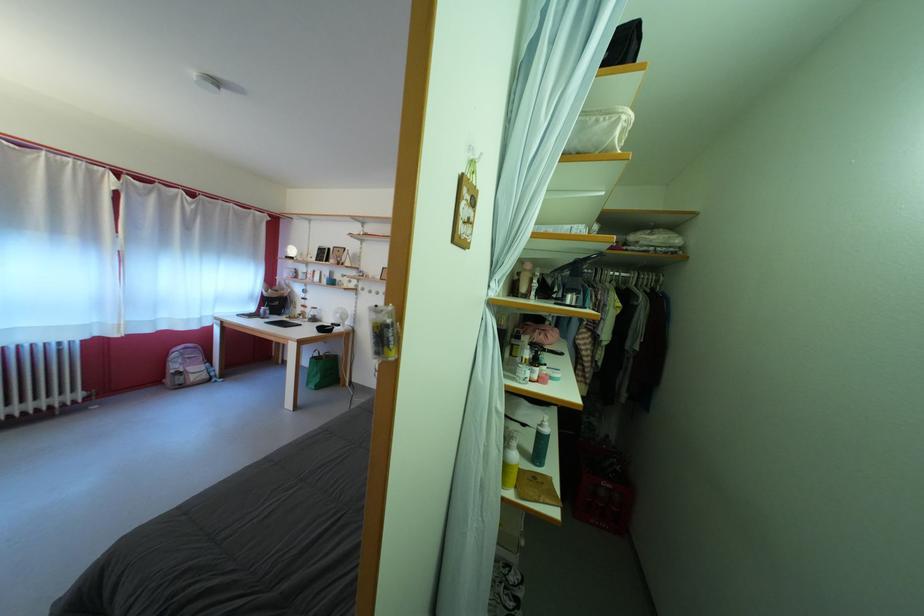
This screenshot has width=924, height=616. Find the location of `pink jar lid`. pink jar lid is located at coordinates (542, 377).